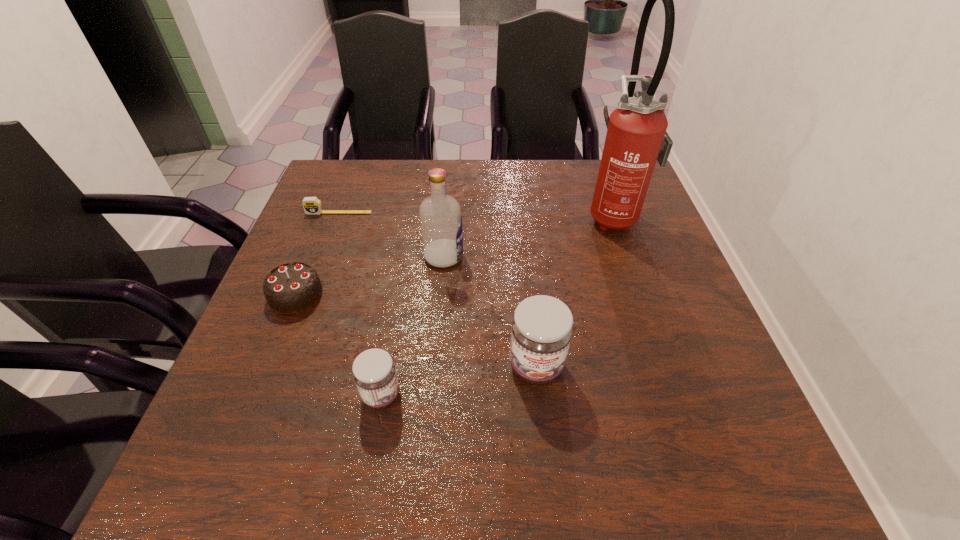
Identify the location of object that is the fourth closest to the left jam. (312, 205).

I want to click on vacant space that satisfies the following two spatial constraints: 1. at the nozzle of the tallest object; 2. on the front label of the second object from right to left, so click(667, 366).

Locate an element on the screen. Image resolution: width=960 pixels, height=540 pixels. vacant position in the image that satisfies the following two spatial constraints: 1. at the nozzle of the fire extinguisher; 2. on the front label of the fourth shortest object is located at coordinates (667, 366).